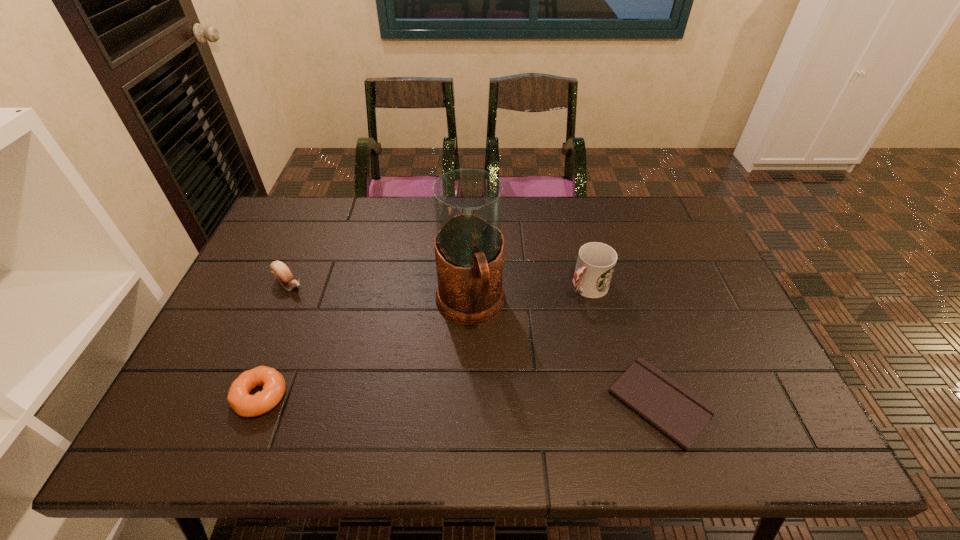
The height and width of the screenshot is (540, 960). What are the coordinates of `free point between the checkbook and the third object from left to right` in the screenshot? It's located at (564, 355).

Locate an element on the screen. The height and width of the screenshot is (540, 960). unoccupied area between the pitcher and the cup is located at coordinates (529, 297).

Find the location of a particular element. free spot between the second tallest object and the third object from left to right is located at coordinates (529, 297).

Locate an element on the screen. The image size is (960, 540). free space between the cup and the doughnut is located at coordinates (424, 342).

The height and width of the screenshot is (540, 960). What are the coordinates of `unoccupied position between the fourth tallest object and the cup` in the screenshot? It's located at (424, 342).

This screenshot has height=540, width=960. In order to click on free spot between the second tallest object and the tallest object in this screenshot , I will do `click(529, 297)`.

Identify the location of free space that is in between the third object from right to left and the escargot. (380, 295).

Choose which object is the nearest neighbor to the third object from left to right. Please provide its 2D coordinates. Your answer should be formatted as a tuple, i.e. [(x, y)], where the tuple contains the x and y coordinates of a point satisfying the conditions above.

[(596, 261)]

Image resolution: width=960 pixels, height=540 pixels. Find the location of `the fourth closest object to the third tallest object`. the fourth closest object to the third tallest object is located at coordinates (678, 413).